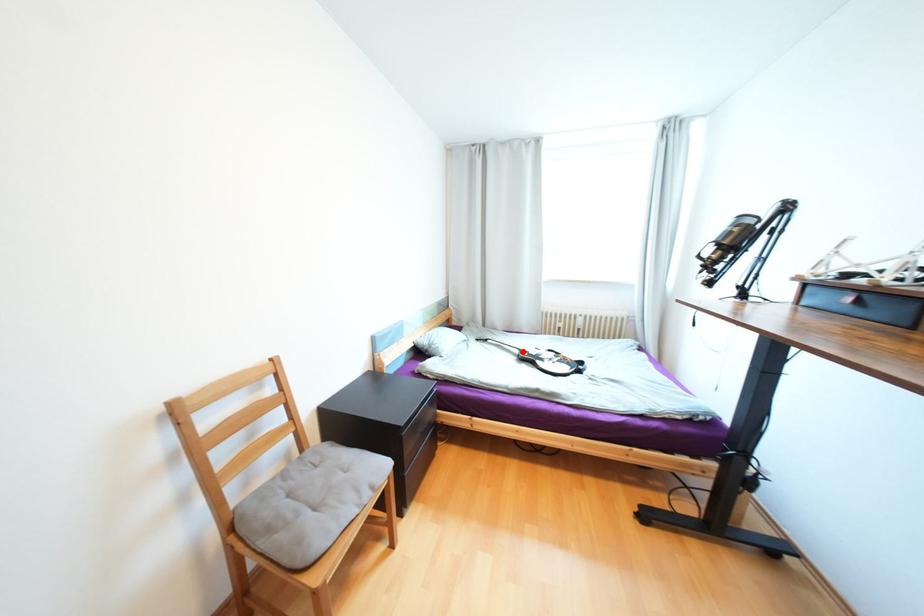
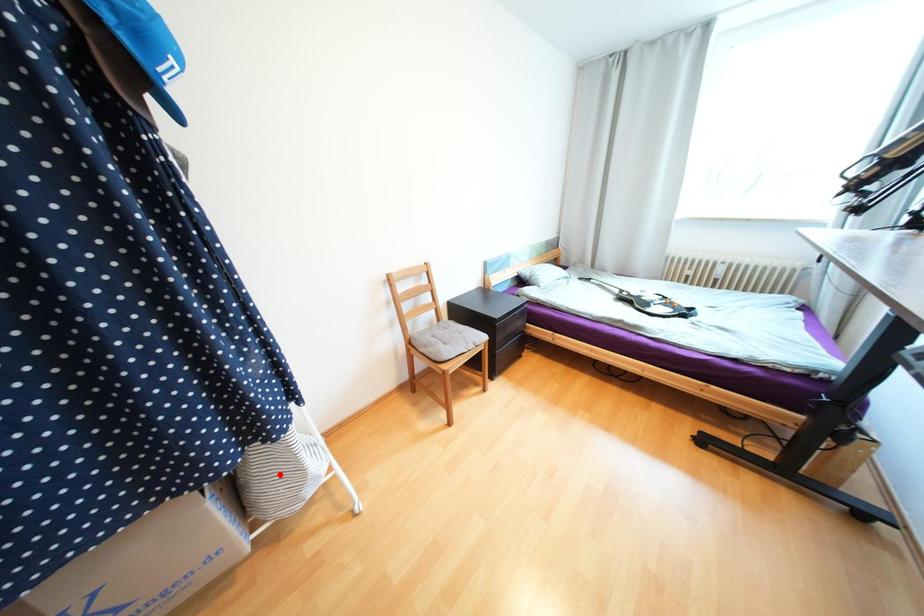
I am providing you with two images of the same scene from different viewpoints. A red point is marked on the first image and another point is marked on the second image. Is the red point in image1 aligned with the point shown in image2?

No